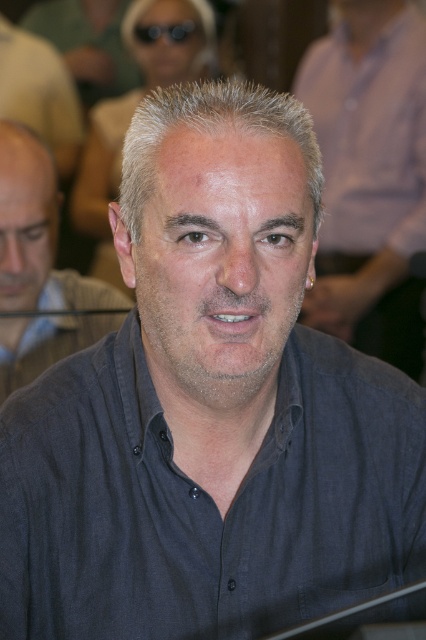
Question: Among these points, which one is nearest to the camera?

Choices:
 (A) (143, 35)
 (B) (14, 68)
 (C) (391, 92)

Answer: (C)

Question: Does dark gray shirt at center appear on the left side of black plastic goggles at upper center?

Choices:
 (A) no
 (B) yes

Answer: (B)

Question: Estimate the real-world distances between objects in this image. Which object is closer to the dark gray shirt at center?

Choices:
 (A) black plastic goggles at upper center
 (B) matte gray shirt at left

Answer: (B)

Question: Can you confirm if matte gray shirt at left is bigger than black plastic goggles at upper center?

Choices:
 (A) yes
 (B) no

Answer: (A)

Question: Can you confirm if dark gray shirt at center is positioned to the right of black plastic goggles at upper center?

Choices:
 (A) yes
 (B) no

Answer: (B)

Question: Which object is positioned closest to the gray matte shirt at center?

Choices:
 (A) matte gray shirt at left
 (B) dark gray shirt at center

Answer: (A)